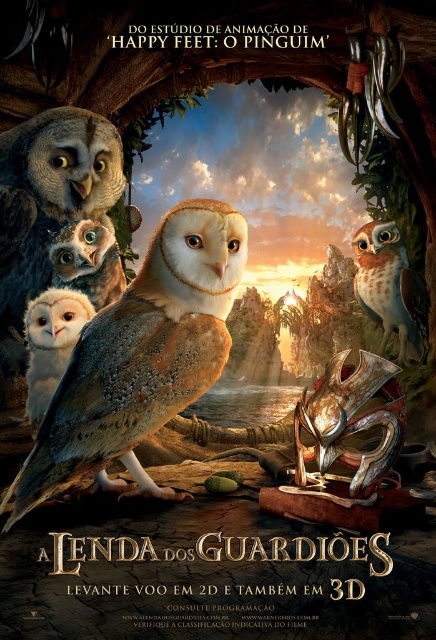
Question: Which point is farther from the camera taking this photo?

Choices:
 (A) (115, 289)
 (B) (60, 305)

Answer: (A)

Question: Does brown speckled feathers owl at center have a lesser width compared to white matte owl at lower left?

Choices:
 (A) yes
 (B) no

Answer: (B)

Question: Is white matte owl at lower left in front of matte brown owl at center?

Choices:
 (A) no
 (B) yes

Answer: (B)

Question: Among these objects, which one is farthest from the camera?

Choices:
 (A) white matte owl at lower left
 (B) matte brown owl at center

Answer: (B)

Question: From the image, what is the correct spatial relationship of rustic wood owl at right in relation to white matte owl at lower left?

Choices:
 (A) below
 (B) above

Answer: (B)

Question: Which is nearer to the brown speckled feathers owl at center?

Choices:
 (A) matte brown owl at center
 (B) white matte owl at lower left
 (C) rustic wood owl at right

Answer: (B)